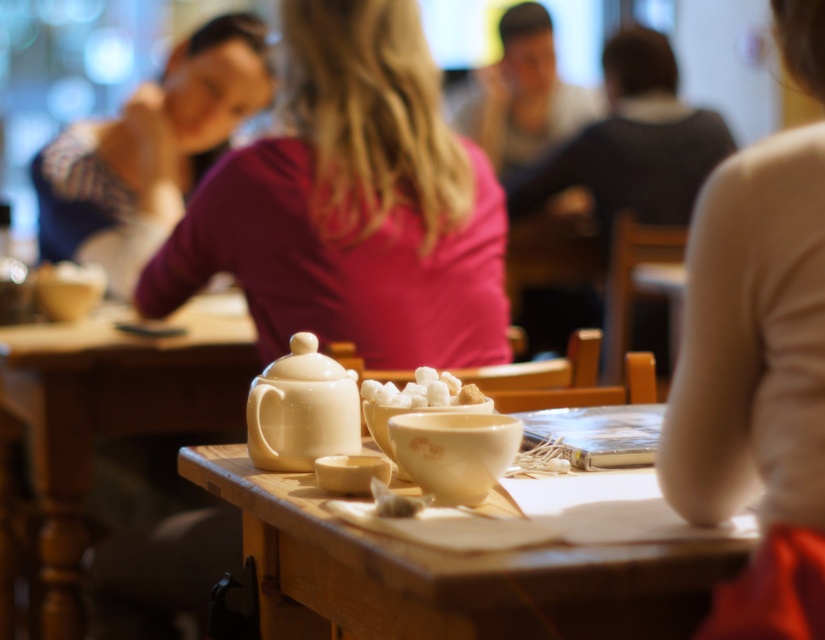
You are a customer sitting at the table with the matte white teapot at lower left. You want to hand a napkin to someone wearing the matte pink shirt at center. Can you reach them without moving your seat?

The matte pink shirt at center is above the matte white teapot at lower left, so yes, you can reach them without moving your seat since the shirt is positioned higher up.

You are a customer at the cafe and want to pour tea into your cup. The white glossy teapot at center and the white sugar cubes at center are on the table. Which object is closer to you?

The white glossy teapot at center is located below the white sugar cubes at center, so it is closer to you since it is positioned lower on the table.